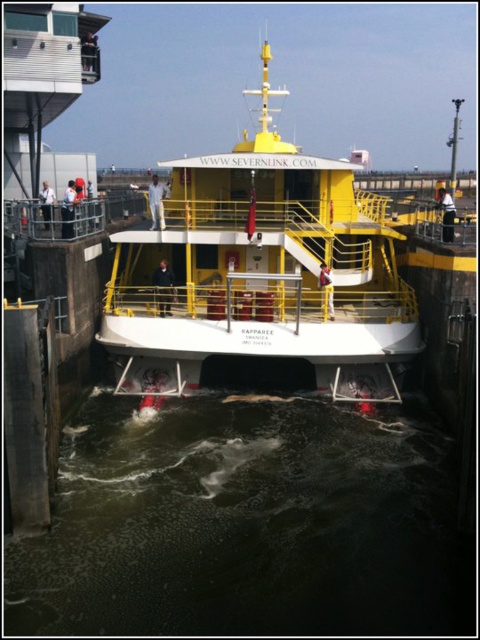
You are a passenger on the ferry and want to see the water level compared to the boat. Which object is lower in height between the dark murky water at lower center and the yellow matte boat at center?

The dark murky water at lower center is shorter than the yellow matte boat at center, so the water is lower in height compared to the boat.

You are standing on the deck of the ferry Rapparee and looking down. Where is the dark murky water at lower center located in terms of its 2D coordinates?

The dark murky water at lower center is located at the 2D coordinates of point (244, 525).

You are standing on the deck of the ferry Rapparee and want to take a photo. You notice two points marked on the ferry, point (x=101, y=524) and point (x=289, y=184). Which point is closer to you so that it appears larger in your photo?

Point (x=101, y=524) is closer to the viewer than point (x=289, y=184), so it will appear larger in the photo.